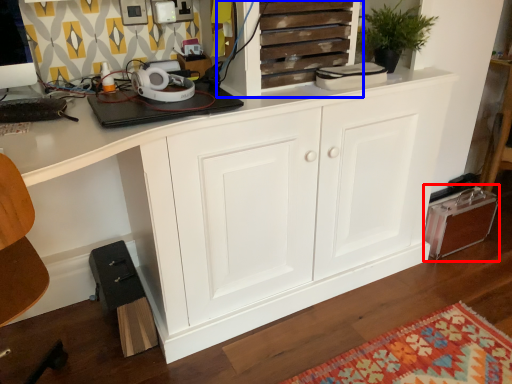
Question: Among these objects, which one is nearest to the camera, cabinetry (highlighted by a red box) or cupboard (highlighted by a blue box)?

Choices:
 (A) cabinetry
 (B) cupboard

Answer: (B)